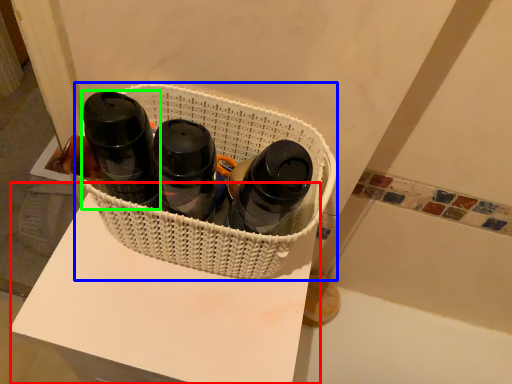
Question: Which object is positioned closest to table (highlighted by a red box)? Select from basket (highlighted by a blue box) and bottle (highlighted by a green box).

Choices:
 (A) basket
 (B) bottle

Answer: (A)